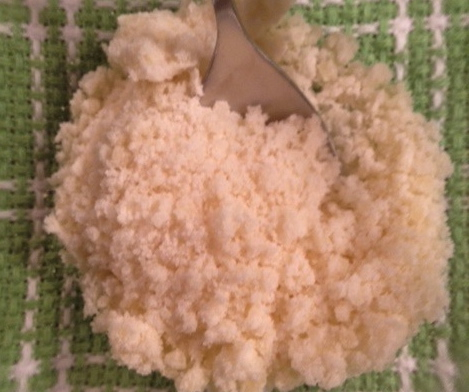
Locate an element on the screen. This screenshot has height=392, width=469. tablecloth is located at coordinates (454, 81).